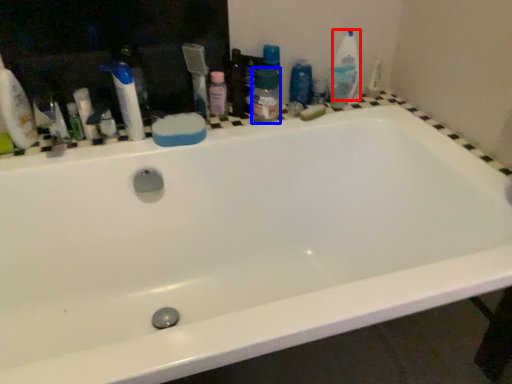
Question: Which point is further to the camera, cleaning product (highlighted by a red box) or toiletry (highlighted by a blue box)?

Choices:
 (A) cleaning product
 (B) toiletry

Answer: (A)